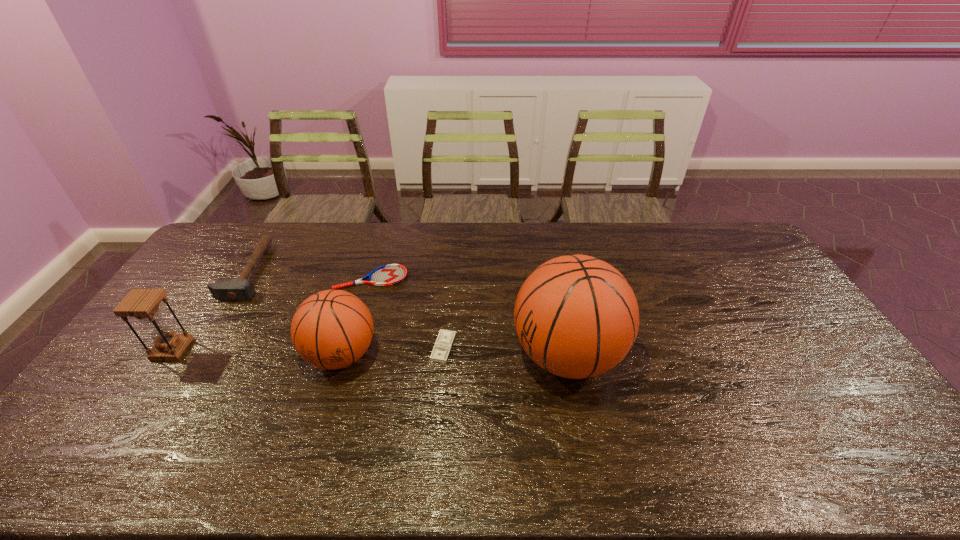
Please point out where to position a new basketball on the right to maintain spacing. Please provide its 2D coordinates. Your answer should be formatted as a tuple, i.e. [(x, y)], where the tuple contains the x and y coordinates of a point satisfying the conditions above.

[(794, 357)]